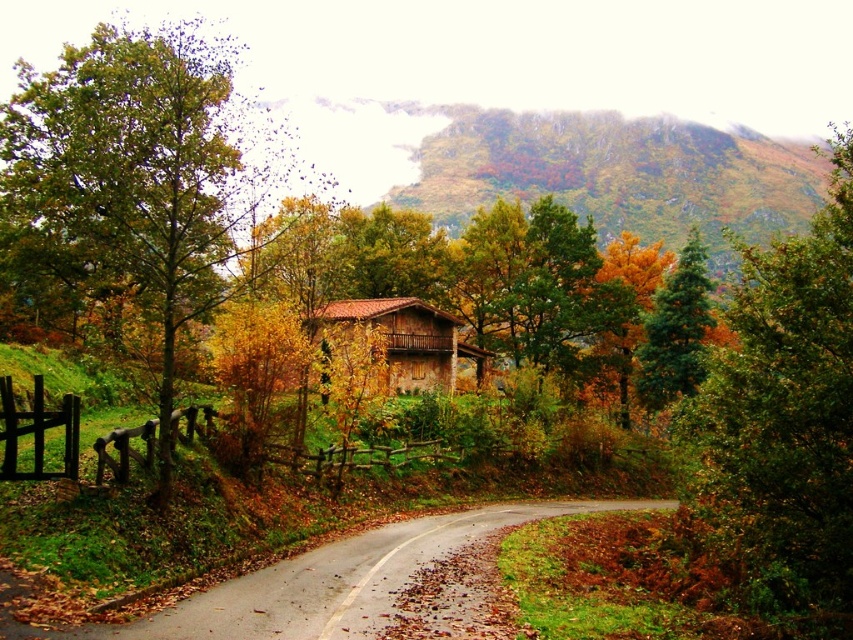
Does green mossy hillside at upper center have a greater width compared to brown wooden fence at center?

Indeed, green mossy hillside at upper center has a greater width compared to brown wooden fence at center.

Can you confirm if green mossy hillside at upper center is positioned to the right of brown wooden fence at center?

Yes, green mossy hillside at upper center is to the right of brown wooden fence at center.

Is point (759, 196) closer to camera compared to point (408, 413)?

That is False.

Locate an element on the screen. This screenshot has width=853, height=640. green mossy hillside at upper center is located at coordinates (618, 173).

Is point (773, 476) in front of point (392, 305)?

Yes.

Measure the distance between point (780,564) and camera.

A distance of 13.09 meters exists between point (780,564) and camera.

Where is `green leafy tree at upper right`? The height and width of the screenshot is (640, 853). green leafy tree at upper right is located at coordinates (782, 422).

From the picture: Which of these two, green matte tree at upper center or brown stone house at center, stands taller?

Standing taller between the two is green matte tree at upper center.

Who is positioned more to the left, green matte tree at upper center or brown stone house at center?

brown stone house at center

Where is `green matte tree at upper center`? Image resolution: width=853 pixels, height=640 pixels. green matte tree at upper center is located at coordinates (676, 330).